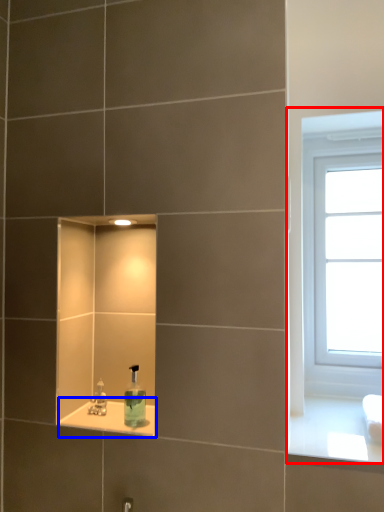
Question: Which object appears closest to the camera in this image, window (highlighted by a red box) or window sill (highlighted by a blue box)?

Choices:
 (A) window
 (B) window sill

Answer: (B)